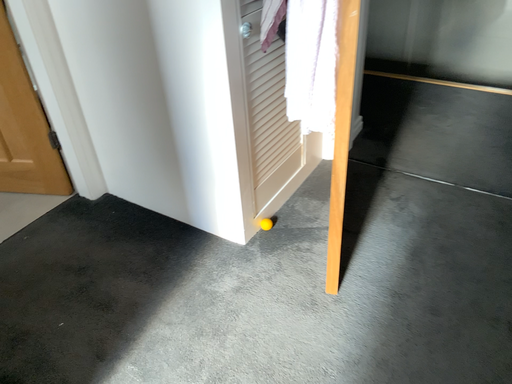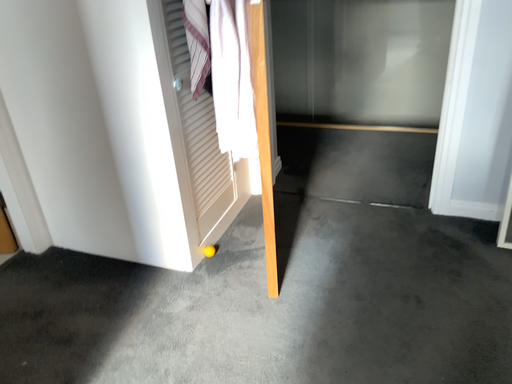
Question: How did the camera likely rotate when shooting the video?

Choices:
 (A) rotated left
 (B) rotated right

Answer: (B)